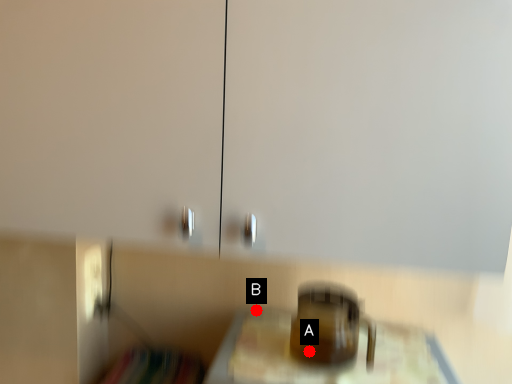
Question: Two points are circled on the image, labeled by A and B beside each circle. Which of the following is the closest to the observer?

Choices:
 (A) A is closer
 (B) B is closer

Answer: (A)